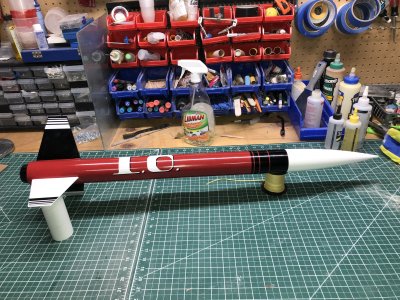
What are the coordinates of `trays` in the screenshot? It's located at click(142, 63).